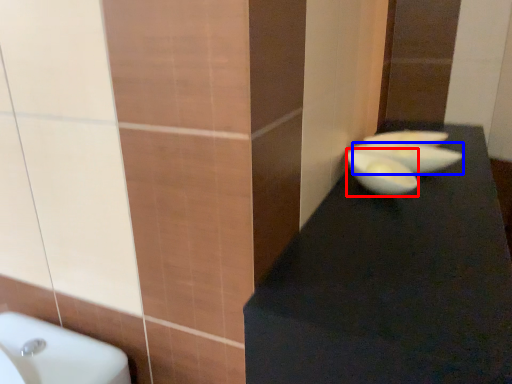
Question: Which object is closer to the camera taking this photo, glass bowl (highlighted by a red box) or basin (highlighted by a blue box)?

Choices:
 (A) glass bowl
 (B) basin

Answer: (A)